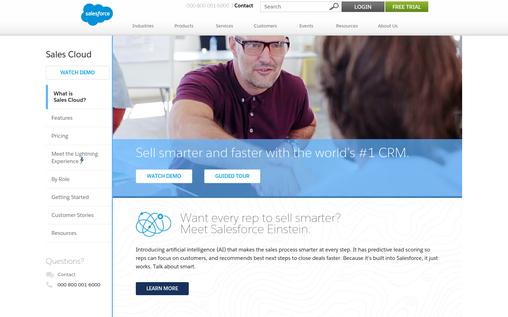
The image size is (508, 317). I want to click on table, so click(x=203, y=55).